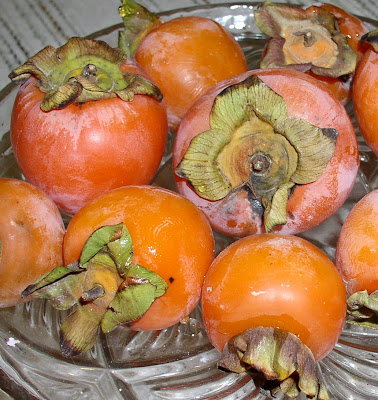
At what (x,y) coordinates should I click in order to perform the action: click on glass bowl. Please return your answer as a coordinate pair (x, y). The image size is (378, 400). Looking at the image, I should click on (54, 365).